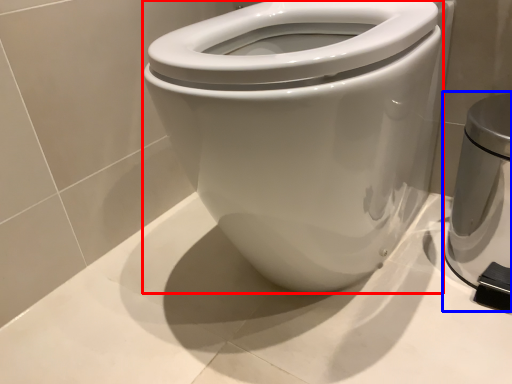
Question: Which object is further to the camera taking this photo, bidet (highlighted by a red box) or appliance (highlighted by a blue box)?

Choices:
 (A) bidet
 (B) appliance

Answer: (B)